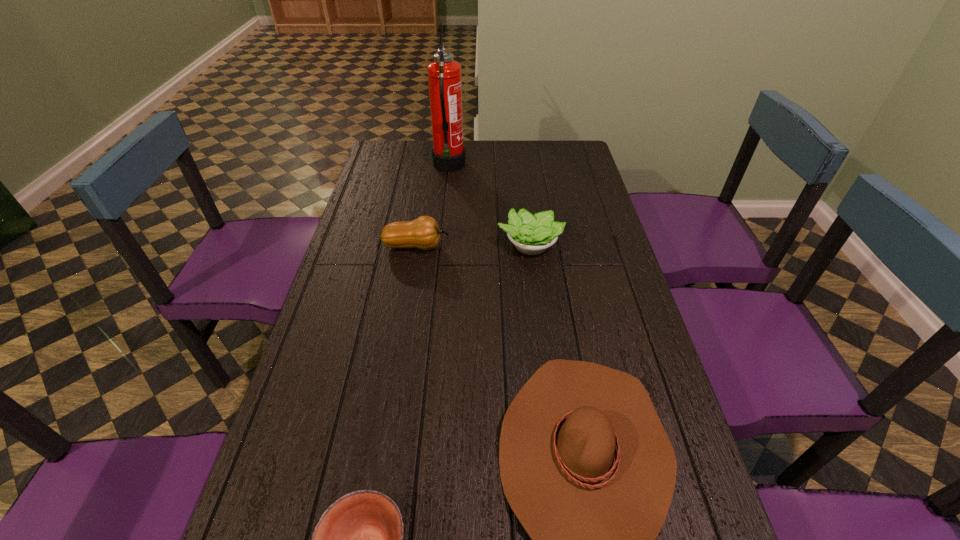
In order to click on fire extinguisher in this screenshot , I will do `click(444, 74)`.

At what (x,y) coordinates should I click in order to perform the action: click on the tallest object. Please return your answer as a coordinate pair (x, y). Looking at the image, I should click on (444, 74).

Identify the location of gourd. (423, 233).

Locate an element on the screen. lettuce is located at coordinates (531, 234).

You are a GUI agent. You are given a task and a screenshot of the screen. Output one action in this format:
    pyautogui.click(x=<x>, y=<y>)
    Task: Click on the vacant position located 0.240m on the front-facing side of the farthest object
    
    Given the screenshot: What is the action you would take?
    pyautogui.click(x=525, y=167)

This screenshot has width=960, height=540. Identify the location of free space located 0.400m on the stem side of the gourd. (573, 246).

At what (x,y) coordinates should I click in order to perform the action: click on vacant space located 0.180m on the back of the lettuce. Please return your answer as a coordinate pair (x, y). Looking at the image, I should click on pyautogui.click(x=524, y=199).

You are a GUI agent. You are given a task and a screenshot of the screen. Output one action in this format:
    pyautogui.click(x=<x>, y=<y>)
    Task: Click on the object positioned at the far edge
    Image resolution: width=960 pixels, height=540 pixels.
    Given the screenshot: What is the action you would take?
    pyautogui.click(x=444, y=74)

The width and height of the screenshot is (960, 540). What are the coordinates of `object present at the left edge` in the screenshot? It's located at (423, 233).

Find the location of a particular element. The height and width of the screenshot is (540, 960). free space at the left edge of the desktop is located at coordinates pos(372,170).